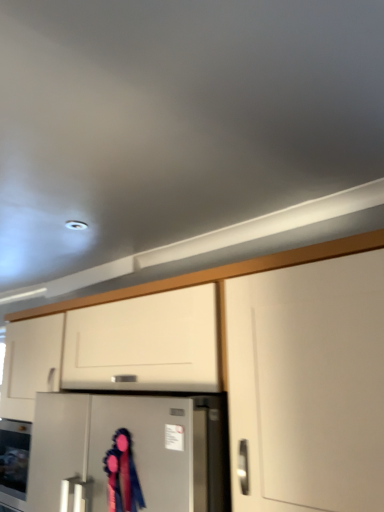
Question: Does point (220, 435) appear closer or farther from the camera than point (306, 259)?

Choices:
 (A) farther
 (B) closer

Answer: (A)

Question: Based on their sizes in the image, would you say satin silver refrigerator at center is bigger or smaller than white matte cabinet at center?

Choices:
 (A) big
 (B) small

Answer: (B)

Question: Which object is positioned farthest from the white matte cabinet at center?

Choices:
 (A) velvet ribbon at center
 (B) satin silver refrigerator at center

Answer: (A)

Question: Which object is positioned closest to the velvet ribbon at center?

Choices:
 (A) satin silver refrigerator at center
 (B) white matte cabinet at center

Answer: (A)